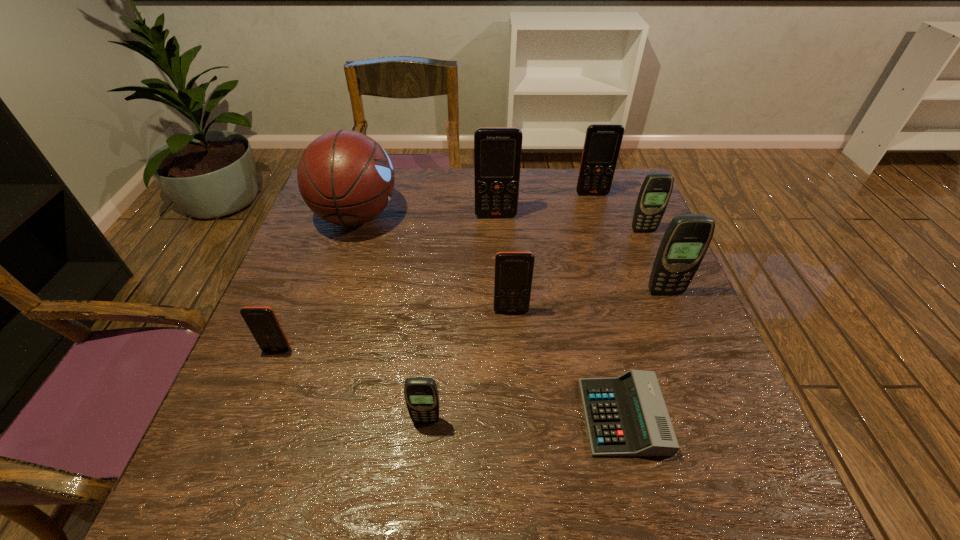
Where is `vacant point located between the basketball and the third nearest object`? This screenshot has width=960, height=540. vacant point located between the basketball and the third nearest object is located at coordinates (317, 283).

You are a GUI agent. You are given a task and a screenshot of the screen. Output one action in this format:
    pyautogui.click(x=<x>, y=<y>)
    Task: Click on the free space between the smallest gray cellular telephone and the calculator
    Image resolution: width=960 pixels, height=540 pixels.
    Given the screenshot: What is the action you would take?
    pyautogui.click(x=524, y=418)

Where is `unoccupied area between the third nearest object and the second farthest orange cellular telephone`? The width and height of the screenshot is (960, 540). unoccupied area between the third nearest object and the second farthest orange cellular telephone is located at coordinates (387, 283).

Identify the location of free space between the basketball and the fifth farthest cellular telephone. (434, 264).

The width and height of the screenshot is (960, 540). Identify the location of vacant space in between the tallest cellular telephone and the second biggest gray cellular telephone. (569, 223).

This screenshot has width=960, height=540. Find the location of `free space between the third farthest orange cellular telephone and the leftmost cellular telephone`. free space between the third farthest orange cellular telephone and the leftmost cellular telephone is located at coordinates (395, 330).

The image size is (960, 540). In order to click on empty space that is in between the second nearest orange cellular telephone and the fifth nearest cellular telephone in this screenshot , I will do `click(577, 271)`.

Locate an element on the screen. The width and height of the screenshot is (960, 540). vacant space that is in between the basketball and the second smallest gray cellular telephone is located at coordinates (499, 224).

Identify which object is the fourth closest to the fifth cellular telephone from left to right. Please provide its 2D coordinates. Your answer should be formatted as a tuple, i.e. [(x, y)], where the tuple contains the x and y coordinates of a point satisfying the conditions above.

[(513, 277)]

Where is `object that is the second closest to the leftmost orange cellular telephone`? This screenshot has height=540, width=960. object that is the second closest to the leftmost orange cellular telephone is located at coordinates (345, 177).